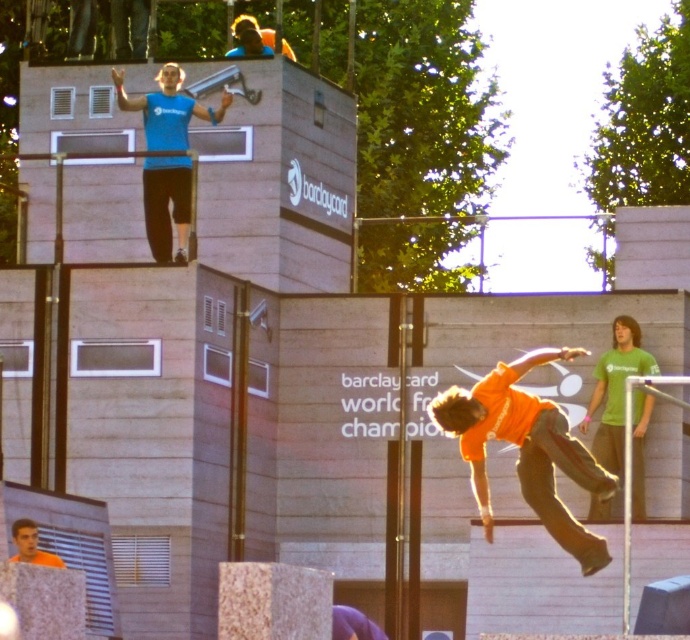
Can you confirm if orange cotton shirt at center is taller than matte blue shirt at upper center?

Correct, orange cotton shirt at center is much taller as matte blue shirt at upper center.

Is orange cotton shirt at center wider than matte blue shirt at upper center?

In fact, orange cotton shirt at center might be narrower than matte blue shirt at upper center.

The image size is (690, 640). Describe the element at coordinates (526, 451) in the screenshot. I see `orange cotton shirt at center` at that location.

Identify the location of orange cotton shirt at center. The height and width of the screenshot is (640, 690). (526, 451).

Can you confirm if orange cotton shirt at center is shorter than orange shirt at center?

Yes, orange cotton shirt at center is shorter than orange shirt at center.

Between point (442, 417) and point (61, 561), which one is positioned behind?

The point (442, 417) is behind.

This screenshot has width=690, height=640. I want to click on orange cotton shirt at center, so click(526, 451).

Where is `orange cotton shirt at center`? The image size is (690, 640). orange cotton shirt at center is located at coordinates (526, 451).

Is matte blue shirt at upper center taller than orange shirt at center?

Incorrect, matte blue shirt at upper center's height is not larger of orange shirt at center's.

Does matte blue shirt at upper center appear on the left side of orange shirt at center?

No, matte blue shirt at upper center is not to the left of orange shirt at center.

Where is `matte blue shirt at upper center`? The height and width of the screenshot is (640, 690). matte blue shirt at upper center is located at coordinates (167, 109).